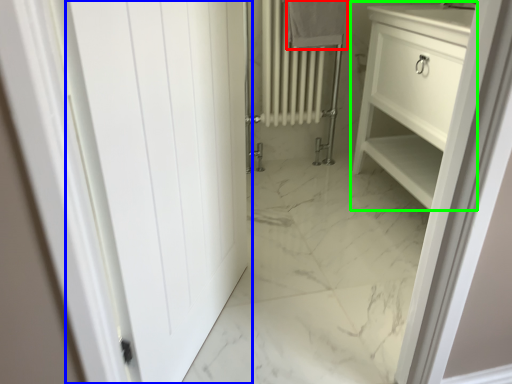
Question: Based on their relative distances, which object is nearer to bath towel (highlighted by a red box)? Choose from door (highlighted by a blue box) and bathroom cabinet (highlighted by a green box).

Choices:
 (A) door
 (B) bathroom cabinet

Answer: (B)